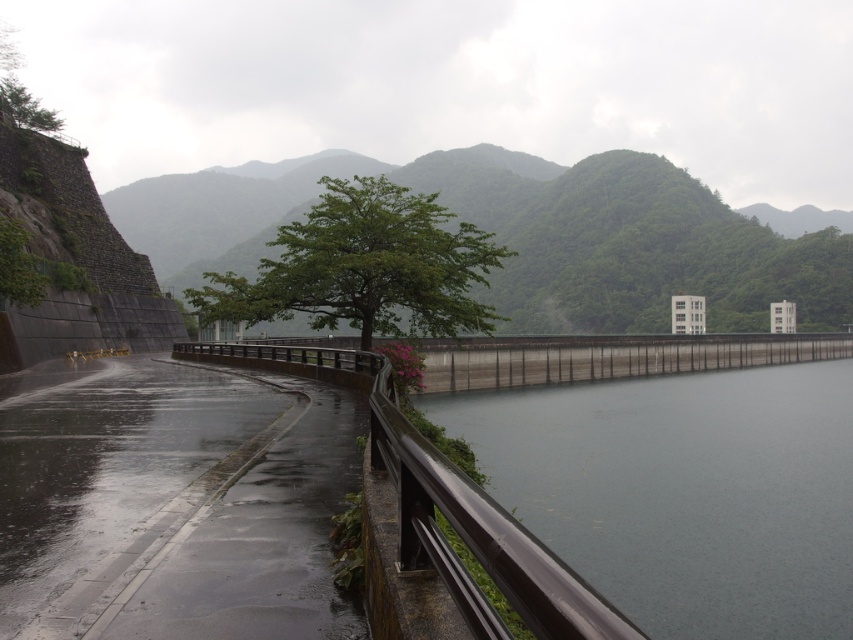
Can you confirm if green leafy tree at center is bigger than smooth metal railing at center?

Correct, green leafy tree at center is larger in size than smooth metal railing at center.

The height and width of the screenshot is (640, 853). Identify the location of green leafy tree at center. (364, 268).

Where is `green leafy tree at center`? Image resolution: width=853 pixels, height=640 pixels. green leafy tree at center is located at coordinates (364, 268).

The image size is (853, 640). What do you see at coordinates (630, 243) in the screenshot?
I see `green leafy mountain at center` at bounding box center [630, 243].

Between point (770, 276) and point (320, 268), which one is positioned in front?

Point (320, 268) is in front.

Is point (579, 257) positioned before point (392, 282)?

No, it is not.

I want to click on green leafy mountain at center, so click(x=630, y=243).

Can you confirm if gray concrete dam at center is bigger than green leafy mountain at center?

No, gray concrete dam at center is not bigger than green leafy mountain at center.

Which is in front, point (550, 403) or point (552, 316)?

Point (550, 403) is in front.

Is point (665, 538) behind point (416, 182)?

No.

The height and width of the screenshot is (640, 853). In order to click on gray concrete dam at center in this screenshot , I will do `click(683, 492)`.